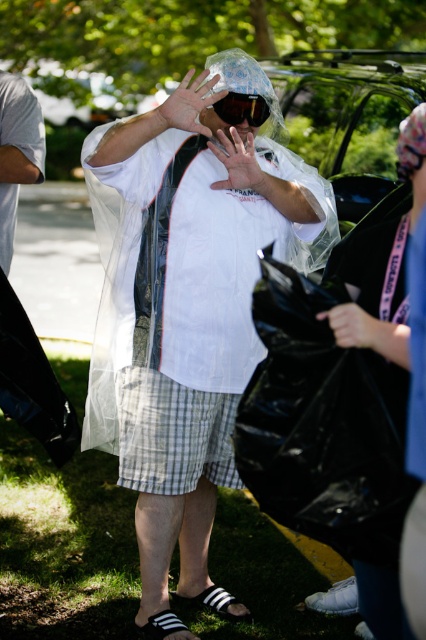
Question: Which point is closer to the camera taking this photo?

Choices:
 (A) (11, 172)
 (B) (241, 483)
 (C) (235, 138)

Answer: (C)

Question: Which of the following is the closest to the observer?

Choices:
 (A) (371, 531)
 (B) (224, 461)

Answer: (A)

Question: Is transparent plastic poncho at center further to camera compared to translucent plastic hand at center?

Choices:
 (A) no
 (B) yes

Answer: (B)

Question: Estimate the real-world distances between objects in this image. Which object is closer to the black plastic bag at center?

Choices:
 (A) blue fabric bag at right
 (B) matte white hand at center
 (C) black matte goggles at center

Answer: (A)

Question: Where is black plastic bag at center located in relation to blue fabric bag at right in the image?

Choices:
 (A) below
 (B) above

Answer: (A)

Question: Observing the image, what is the correct spatial positioning of transparent plastic poncho at center in reference to white matte t-shirt at center?

Choices:
 (A) right
 (B) left

Answer: (A)